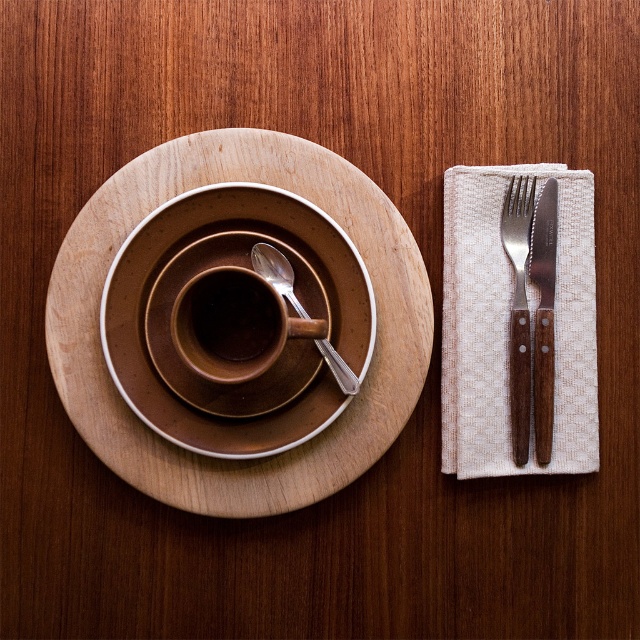
Can you confirm if matte brown cup at center is positioned to the left of wooden fork at right?

Yes, matte brown cup at center is to the left of wooden fork at right.

Who is higher up, matte brown cup at center or wooden fork at right?

matte brown cup at center is higher up.

Locate an element on the screen. This screenshot has height=640, width=640. matte brown cup at center is located at coordinates [x=234, y=314].

The height and width of the screenshot is (640, 640). Find the location of `matte brown cup at center`. matte brown cup at center is located at coordinates click(234, 314).

Based on the photo, is brown matte platter at center bigger than matte brown cup at center?

Yes, brown matte platter at center is bigger than matte brown cup at center.

Is brown matte platter at center to the left of matte brown cup at center from the viewer's perspective?

Incorrect, brown matte platter at center is not on the left side of matte brown cup at center.

Who is more forward, (60, 364) or (278, 328)?

Positioned in front is point (278, 328).

The height and width of the screenshot is (640, 640). I want to click on brown matte platter at center, so click(x=310, y=381).

Does point (186, 141) come farther from viewer compared to point (516, 209)?

No, it is not.

Who is taller, brown matte platter at center or wooden fork at right?

brown matte platter at center

The height and width of the screenshot is (640, 640). In order to click on brown matte platter at center in this screenshot , I will do `click(310, 381)`.

Identify the location of brown matte platter at center. (310, 381).